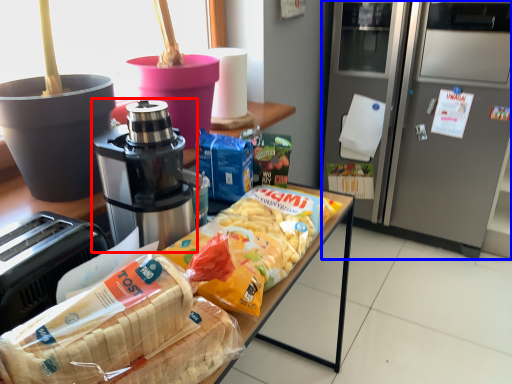
Question: Which point is further to the camera, coffee maker (highlighted by a red box) or home appliance (highlighted by a blue box)?

Choices:
 (A) coffee maker
 (B) home appliance

Answer: (B)